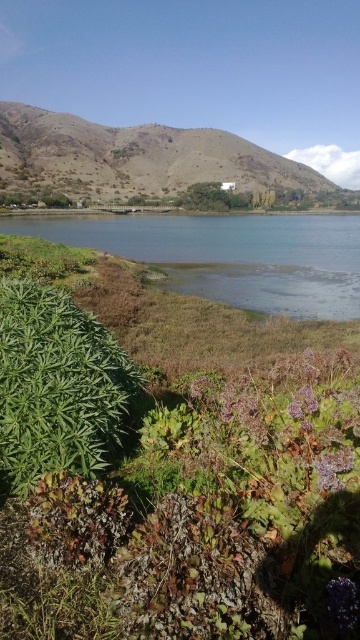
You are a gardener who wants to plant a new flower that requires shade. You have two options in the scene, the green leafy plant at lower left and the purple fuzzy flower at lower center. Which one do you think would provide better shade for the new flower?

The green leafy plant at lower left has a greater height compared to the purple fuzzy flower at lower center, so it would provide better shade for the new flower.

You are standing at the edge of the lake and see the purple matte flower at lower right and the purple fuzzy flower at lower center. Which flower is closer to you?

The purple fuzzy flower at lower center is closer to you since it is only 4.21 feet away from the purple matte flower at lower right, but since you are at the edge of the lake, the distance from you to each flower would depend on their positions relative to the lake. However, based on their placement in the scene, the purple fuzzy flower at lower center is positioned closer to the viewer than the purple matte flower at lower right.